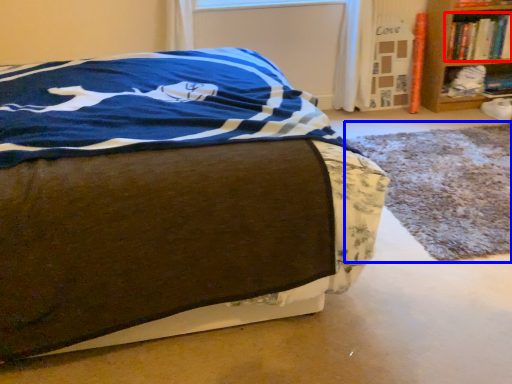
Question: Among these objects, which one is nearest to the camera, book (highlighted by a red box) or cat bed (highlighted by a blue box)?

Choices:
 (A) book
 (B) cat bed

Answer: (B)